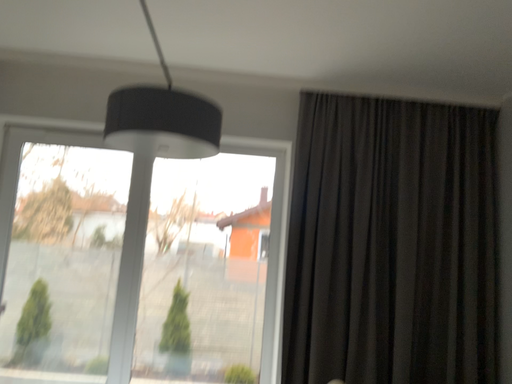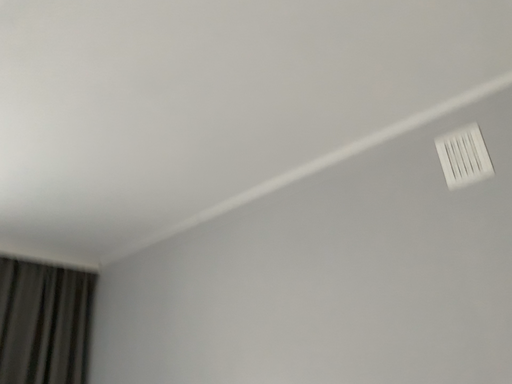
Question: Which way did the camera rotate in the video?

Choices:
 (A) rotated downward
 (B) rotated upward

Answer: (B)